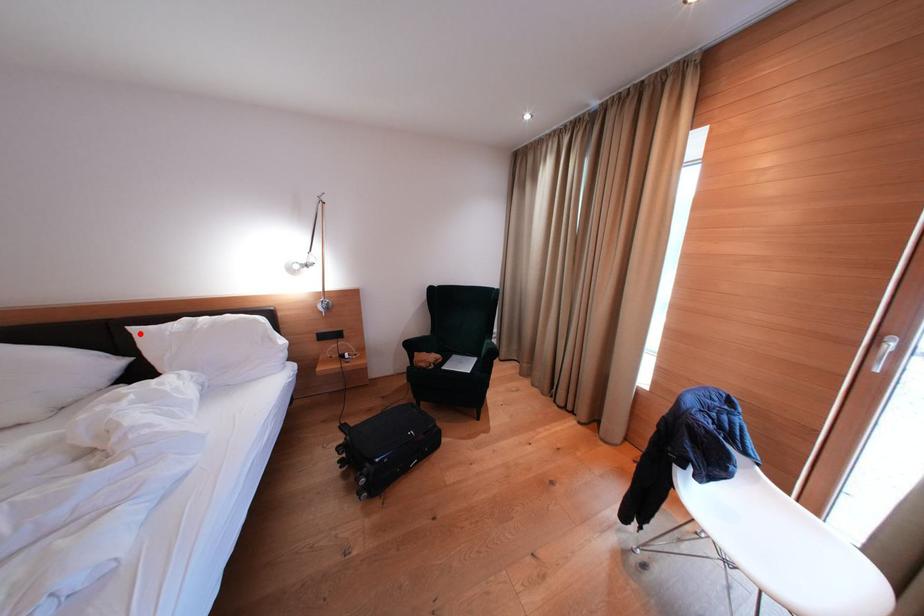
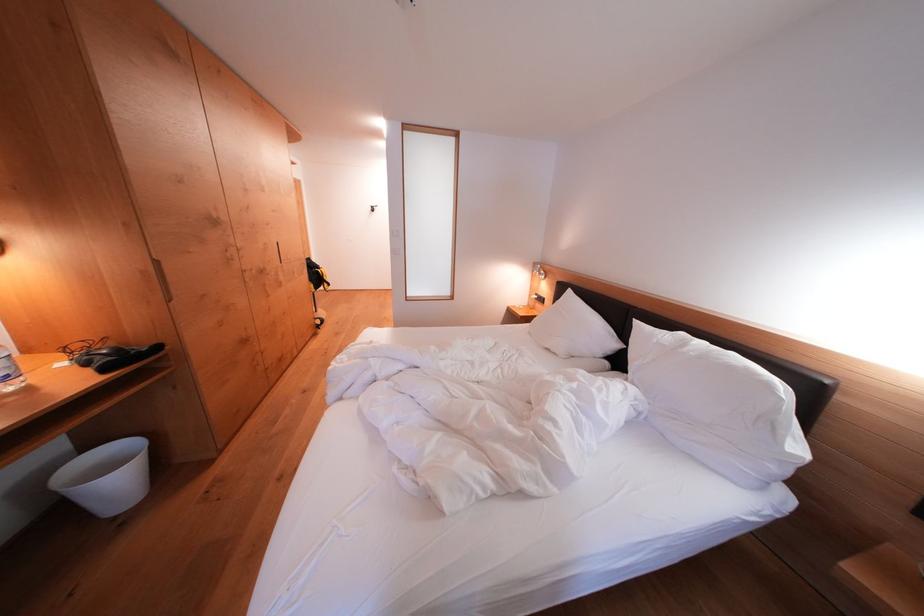
Where in the second image is the point corresponding to the highlighted location from the first image?

(642, 326)